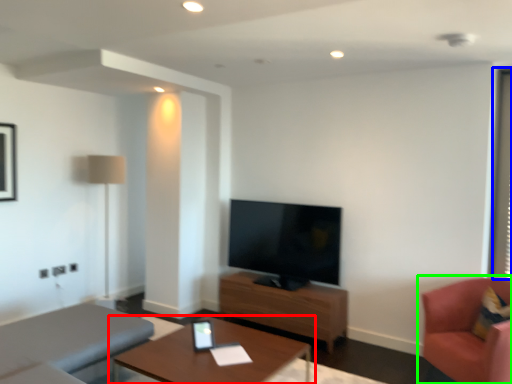
Question: Which object is positioned closest to table (highlighted by a red box)? Select from window screen (highlighted by a blue box) and chair (highlighted by a green box).

Choices:
 (A) window screen
 (B) chair

Answer: (B)